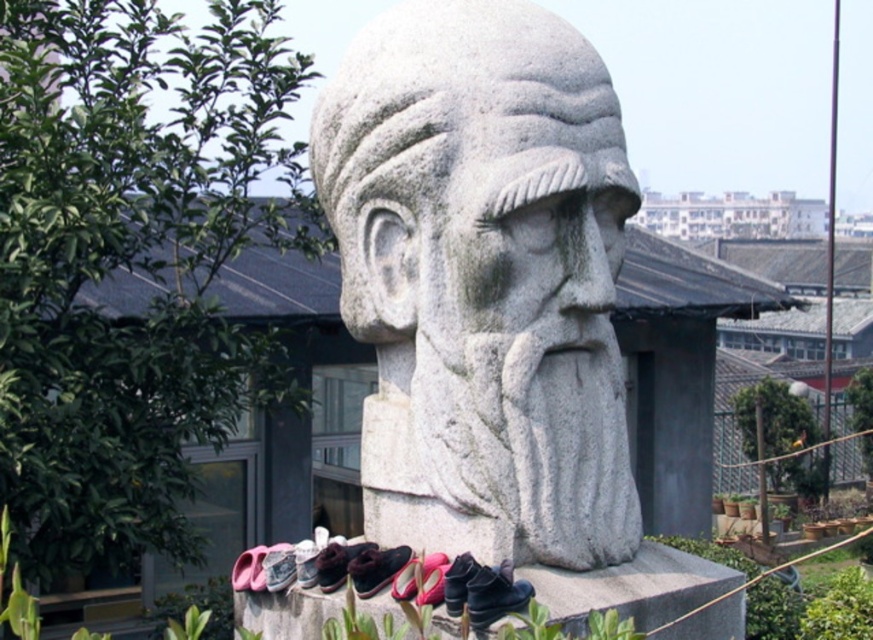
Question: Among these points, which one is farthest from the camera?

Choices:
 (A) (269, 564)
 (B) (245, 584)
 (C) (483, 566)

Answer: (B)

Question: Is black leather shoe at lower center above matte black shoe at center?

Choices:
 (A) yes
 (B) no

Answer: (A)

Question: Estimate the real-world distances between objects in this image. Which object is closer to the brown leather shoe at lower center?

Choices:
 (A) matte black shoe at center
 (B) white stone bust at center
 (C) black leather shoe at lower center
 (D) pink fabric shoe at lower center

Answer: (A)

Question: Can you confirm if white stone bust at center is wider than pink fabric shoe at lower center?

Choices:
 (A) yes
 (B) no

Answer: (A)

Question: Which of the following is the farthest from the observer?

Choices:
 (A) (236, 572)
 (B) (506, 564)

Answer: (A)

Question: Does brown leather shoe at lower center appear on the left side of pink fabric shoe at lower center?

Choices:
 (A) no
 (B) yes

Answer: (A)